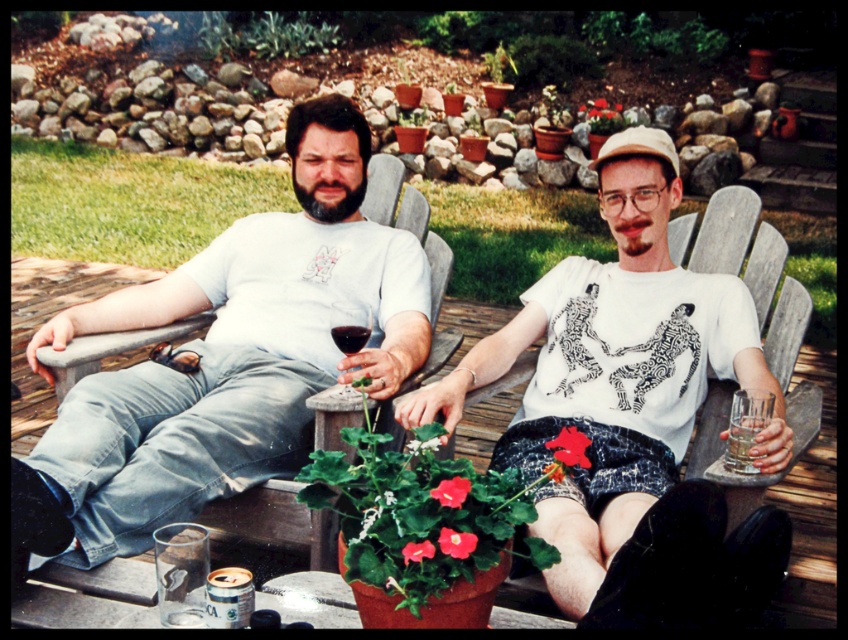
You are standing in the backyard and want to grab the matte glass wine at center. Can you reach it without moving your feet?

The matte glass wine at center is 2.11 meters away from the viewer, which is beyond typical human arm reach. You would need to move closer to grab it.

You are a bartender setting up drinks for two guests. You have a matte glass wine at center and a clear glass water at right. Which glass should you use to serve a beverage that requires a taller container?

The matte glass wine at center has a greater height compared to the clear glass water at right, so it should be used for the beverage requiring a taller container.